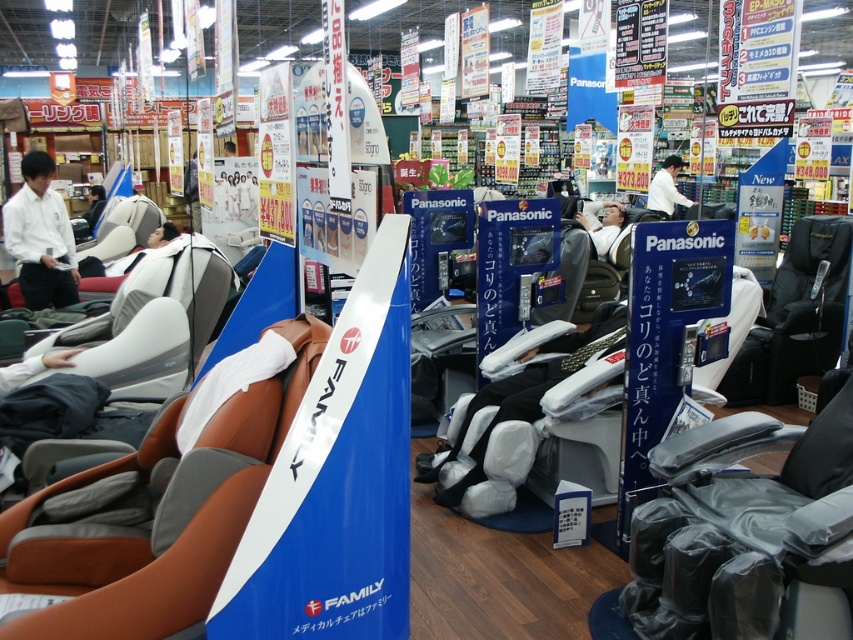
Who is more forward, (30, 556) or (653, 192)?

Point (30, 556) is in front.

Does point (3, 540) come closer to viewer compared to point (653, 180)?

Yes, it is in front of point (653, 180).

At what (x,y) coordinates should I click in order to perform the action: click on brown leather swivel chair at center. Please return your answer as a coordinate pair (x, y). This screenshot has width=853, height=640. Looking at the image, I should click on (155, 508).

The height and width of the screenshot is (640, 853). What do you see at coordinates (735, 528) in the screenshot?
I see `black leather swivel chair at center` at bounding box center [735, 528].

Can you confirm if black leather swivel chair at center is positioned above white shirt at upper center?

No.

Image resolution: width=853 pixels, height=640 pixels. Identify the location of black leather swivel chair at center. (735, 528).

Is white shirt at left positioned behind white shirt at upper center?

No, it is not.

Is white shirt at left to the left of white shirt at upper center from the viewer's perspective?

Indeed, white shirt at left is positioned on the left side of white shirt at upper center.

Is point (19, 205) behind point (651, 182)?

No, (19, 205) is in front of (651, 182).

Locate an element on the screen. white shirt at left is located at coordinates (39, 236).